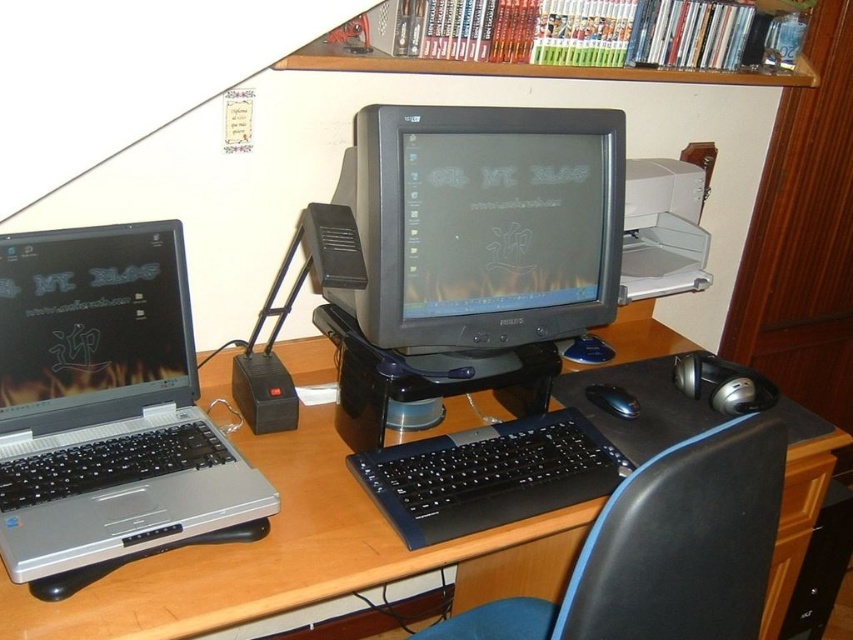
Between wooden desk at center and black plastic keyboard at center, which one has more height?

Standing taller between the two is wooden desk at center.

Does point (311, 346) lie behind point (572, 433)?

Yes, it is.

What do you see at coordinates (297, 556) in the screenshot? This screenshot has height=640, width=853. I see `wooden desk at center` at bounding box center [297, 556].

Identify the location of wooden desk at center. The height and width of the screenshot is (640, 853). (297, 556).

Does black plastic keyboard at center appear under wooden drawer at lower right?

No.

Who is more distant from viewer, (460, 435) or (785, 513)?

The point (785, 513) is behind.

Find the location of a particular element. black plastic keyboard at center is located at coordinates (488, 476).

Between matte black monitor at center and wooden drawer at lower right, which one appears on the left side from the viewer's perspective?

Positioned to the left is matte black monitor at center.

At what (x,y) coordinates should I click in order to perform the action: click on matte black monitor at center. Please return your answer as a coordinate pair (x, y). The image size is (853, 640). Looking at the image, I should click on (483, 225).